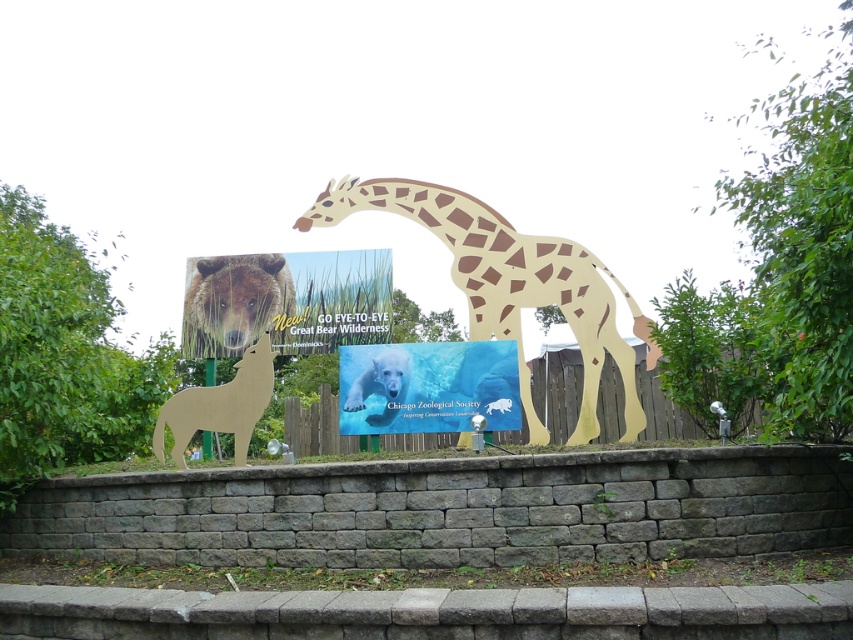
Can you confirm if brown fur bear at upper left is positioned below white glossy polar bear at center?

Actually, brown fur bear at upper left is above white glossy polar bear at center.

Between point (280, 273) and point (405, 369), which one is positioned behind?

Positioned behind is point (280, 273).

The image size is (853, 640). I want to click on brown fur bear at upper left, so click(x=233, y=301).

Based on the photo, which of these two, wooden giraffe at center or wooden wolf at lower left, stands shorter?

wooden wolf at lower left is shorter.

Where is `wooden giraffe at center`? The height and width of the screenshot is (640, 853). wooden giraffe at center is located at coordinates (509, 284).

The image size is (853, 640). Identify the location of wooden giraffe at center. click(x=509, y=284).

This screenshot has height=640, width=853. Find the location of `blue glossy polar bear at center`. blue glossy polar bear at center is located at coordinates (428, 387).

Does point (461, 403) come in front of point (397, 388)?

Yes, point (461, 403) is in front of point (397, 388).

The image size is (853, 640). Find the location of `blue glossy polar bear at center`. blue glossy polar bear at center is located at coordinates (428, 387).